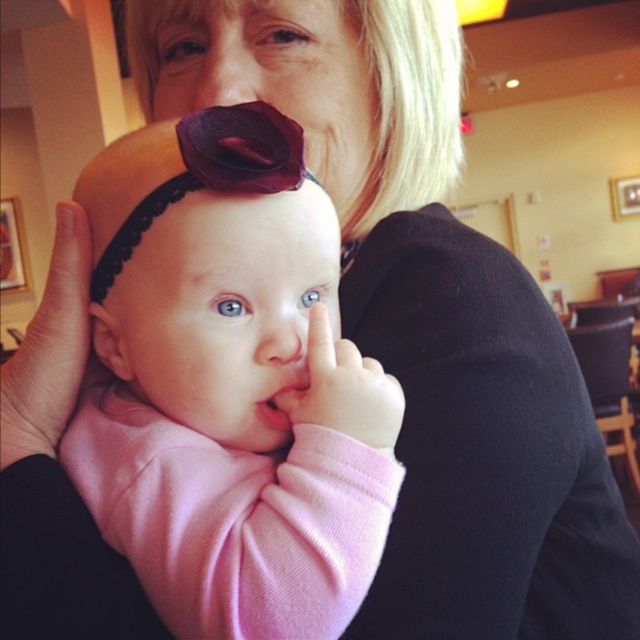
Question: Is the position of pink satin headband at center more distant than that of matte purple flower at center?

Choices:
 (A) no
 (B) yes

Answer: (A)

Question: Is pink satin headband at center smaller than matte purple flower at center?

Choices:
 (A) no
 (B) yes

Answer: (A)

Question: Is the position of pink fabric at center more distant than that of matte purple flower at center?

Choices:
 (A) no
 (B) yes

Answer: (A)

Question: Which object appears closest to the camera in this image?

Choices:
 (A) smooth skin nose at center
 (B) matte purple flower at center
 (C) pink fabric at center

Answer: (A)

Question: Which object is farther from the camera taking this photo?

Choices:
 (A) pink satin headband at center
 (B) matte purple flower at center
 (C) pink fabric at center
 (D) smooth skin nose at center

Answer: (B)

Question: Estimate the real-world distances between objects in this image. Which object is closer to the matte purple flower at center?

Choices:
 (A) pink satin headband at center
 (B) pink fabric at center

Answer: (A)